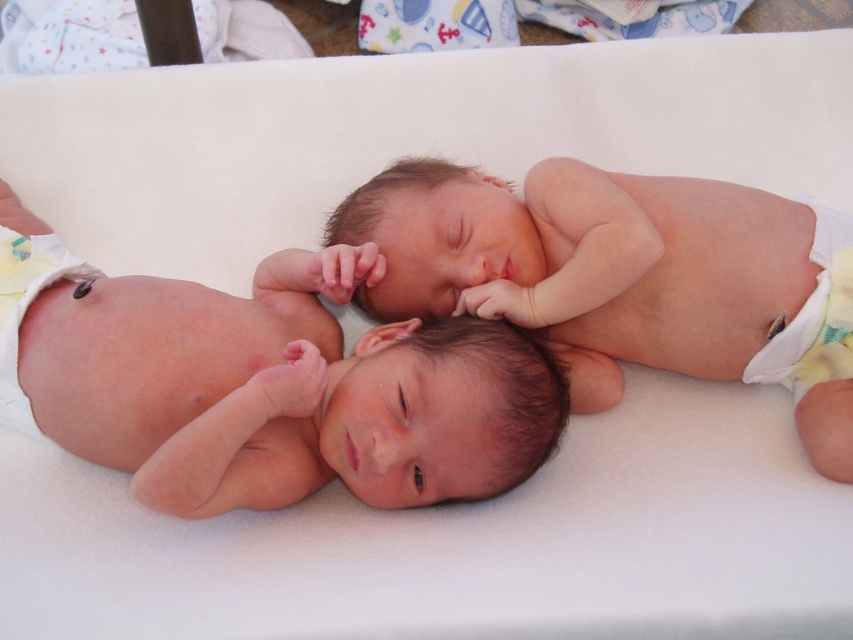
Question: Is white cloth diaper at right below white cloth diaper at left?

Choices:
 (A) no
 (B) yes

Answer: (A)

Question: Is pink smooth skin at center above smooth skin newborn at center?

Choices:
 (A) yes
 (B) no

Answer: (B)

Question: Which object appears farthest from the camera in this image?

Choices:
 (A) pink smooth skin at center
 (B) white cloth diaper at left
 (C) smooth skin newborn at center
 (D) white cloth diaper at right

Answer: (D)

Question: Does smooth skin newborn at center have a larger size compared to white cloth diaper at right?

Choices:
 (A) yes
 (B) no

Answer: (A)

Question: Which of the following is the closest to the observer?

Choices:
 (A) white cloth diaper at left
 (B) white cloth diaper at right

Answer: (A)

Question: Which point is farther to the camera?

Choices:
 (A) white cloth diaper at left
 (B) pink smooth skin at center
 (C) white cloth diaper at right

Answer: (C)